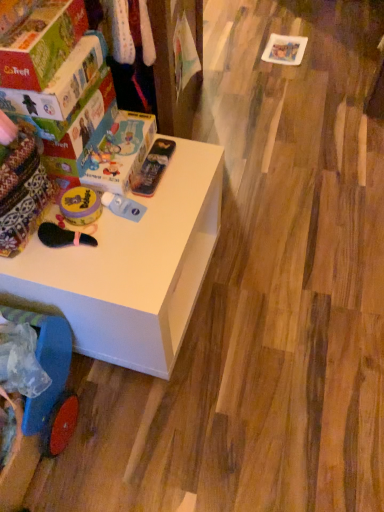
Locate an element on the screen. This screenshot has height=512, width=384. free spot above white matte table at upper left (from a real-world perspective) is located at coordinates (125, 212).